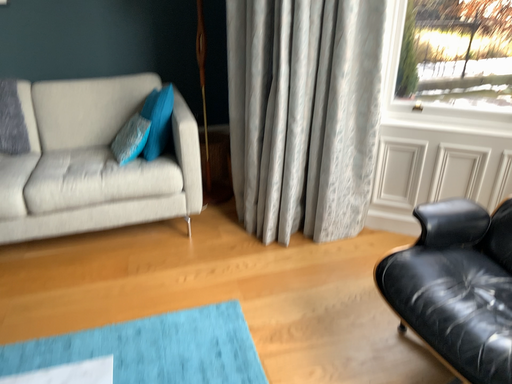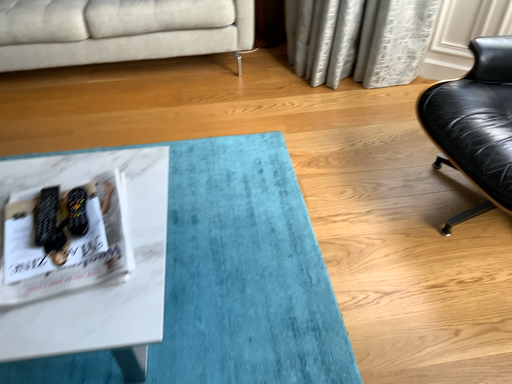
Question: Which way did the camera rotate in the video?

Choices:
 (A) rotated left
 (B) rotated right

Answer: (A)